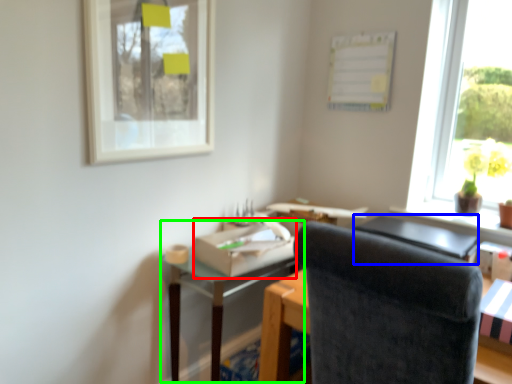
Question: Based on their relative distances, which object is farther from cardboard box (highlighted by a red box)? Choose from table (highlighted by a blue box) and table (highlighted by a green box).

Choices:
 (A) table
 (B) table

Answer: (A)